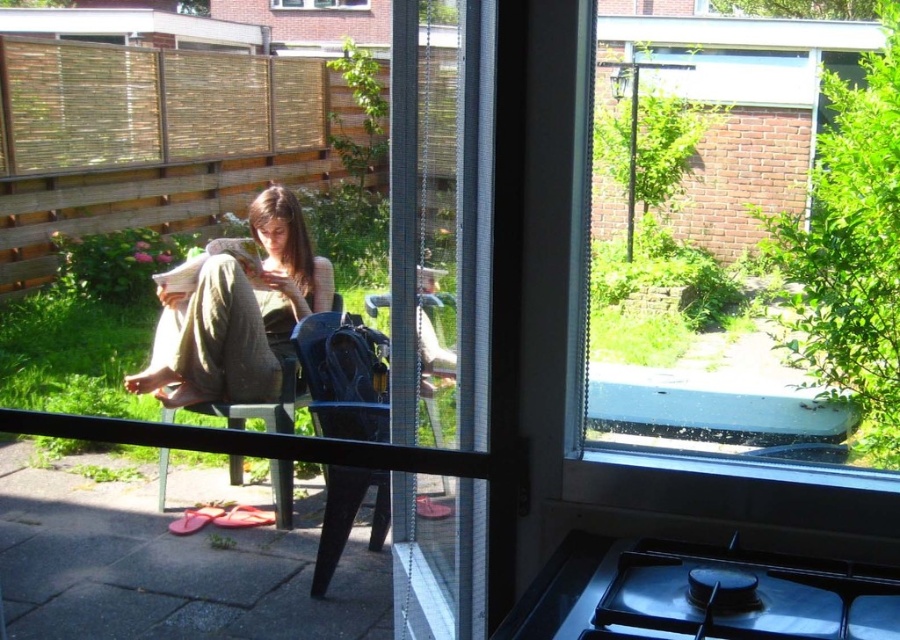
The image size is (900, 640). Identify the location of transparent plastic screen door at center. (450, 317).

Between transparent plastic screen door at center and matte green pants at lower left, which one appears on the left side from the viewer's perspective?

From the viewer's perspective, matte green pants at lower left appears more on the left side.

Is point (461, 413) positioned in front of point (317, 308)?

Yes, it is in front of point (317, 308).

At what (x,y) coordinates should I click in order to perform the action: click on transparent plastic screen door at center. Please return your answer as a coordinate pair (x, y). Looking at the image, I should click on (450, 317).

Who is shorter, matte green pants at lower left or matte black chair at center?

matte black chair at center is shorter.

How much distance is there between matte green pants at lower left and matte black chair at center?

matte green pants at lower left and matte black chair at center are 5.76 feet apart from each other.

The width and height of the screenshot is (900, 640). In order to click on matte green pants at lower left in this screenshot , I will do `click(235, 310)`.

Where is `matte green pants at lower left`? matte green pants at lower left is located at coordinates (235, 310).

Which of these two, black matte gas stove at lower right or clear glass window at center, stands taller?

clear glass window at center is taller.

What do you see at coordinates (699, 595) in the screenshot? I see `black matte gas stove at lower right` at bounding box center [699, 595].

Find the location of a particular element. black matte gas stove at lower right is located at coordinates pyautogui.click(x=699, y=595).